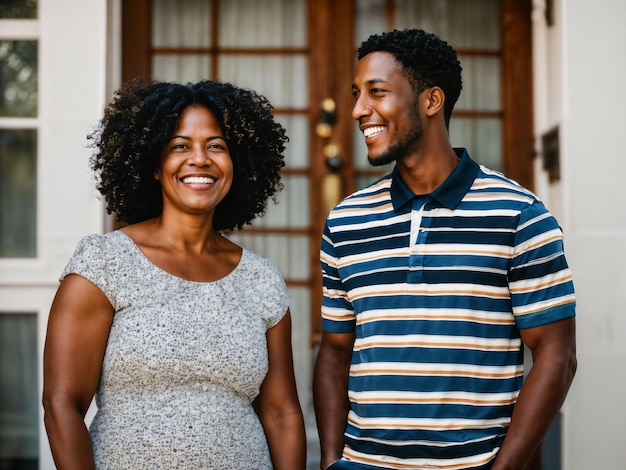
Locate an element on the screen. The width and height of the screenshot is (626, 470). black object on wall is located at coordinates (553, 165).